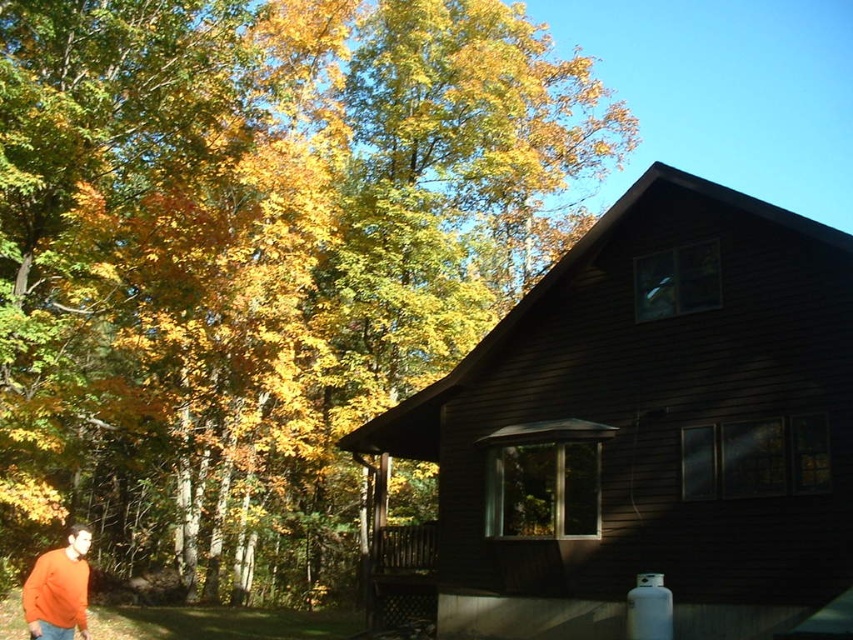
Who is lower down, golden yellow leaves at upper left or orange sweater at lower left?

Positioned lower is orange sweater at lower left.

Is golden yellow leaves at upper left smaller than orange sweater at lower left?

Actually, golden yellow leaves at upper left might be larger than orange sweater at lower left.

Image resolution: width=853 pixels, height=640 pixels. What are the coordinates of `golden yellow leaves at upper left` in the screenshot? It's located at (257, 259).

Does dark wood cabin at center appear on the left side of orange sweater at lower left?

In fact, dark wood cabin at center is to the right of orange sweater at lower left.

Does dark wood cabin at center have a greater width compared to orange sweater at lower left?

Incorrect, dark wood cabin at center's width does not surpass orange sweater at lower left's.

Is point (691, 592) closer to camera compared to point (76, 564)?

No.

Identify the location of dark wood cabin at center. (648, 428).

Looking at this image, which is more to the right, golden yellow leaves at upper left or dark wood cabin at center?

dark wood cabin at center is more to the right.

Who is positioned more to the left, golden yellow leaves at upper left or dark wood cabin at center?

golden yellow leaves at upper left is more to the left.

Is point (404, 484) positioned behind point (721, 586)?

Yes, it is.

The height and width of the screenshot is (640, 853). I want to click on golden yellow leaves at upper left, so click(257, 259).